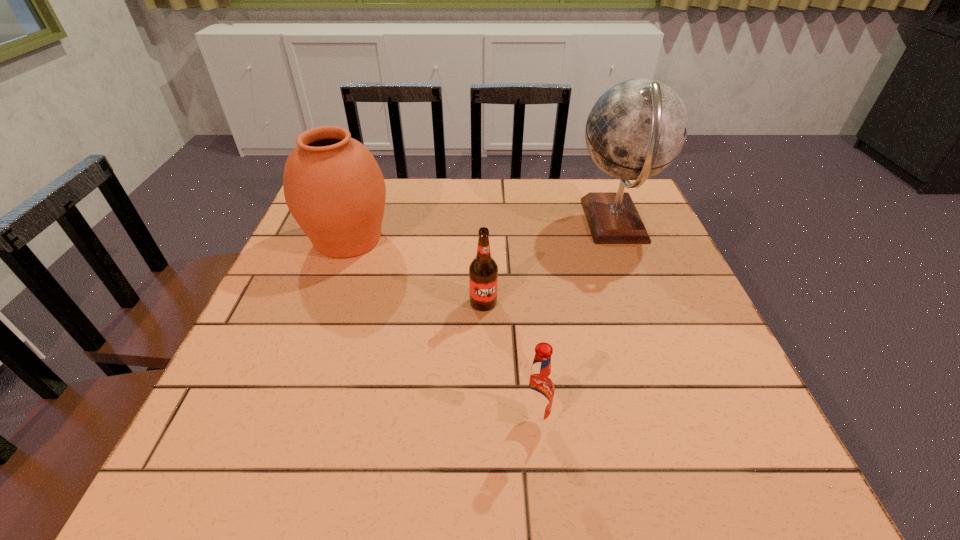
At what (x,y) coordinates should I click in order to perform the action: click on the tallest object. Please return your answer as a coordinate pair (x, y). The width and height of the screenshot is (960, 540). Looking at the image, I should click on click(x=637, y=128).

Where is `the rightmost object`? This screenshot has height=540, width=960. the rightmost object is located at coordinates (637, 128).

At what (x,y) coordinates should I click in order to perform the action: click on the second tallest object. Please return your answer as a coordinate pair (x, y). This screenshot has height=540, width=960. Looking at the image, I should click on (333, 186).

Identify the location of the leftmost object. (333, 186).

Find the location of a particular element. the farther root beer is located at coordinates (483, 271).

You are a GUI agent. You are given a task and a screenshot of the screen. Output one action in this format:
    pyautogui.click(x=<x>, y=<y>)
    Task: Click on the third object from right to left
    The height and width of the screenshot is (540, 960).
    Given the screenshot: What is the action you would take?
    pyautogui.click(x=483, y=271)

The image size is (960, 540). I want to click on the nearer root beer, so click(x=538, y=387).

The width and height of the screenshot is (960, 540). Identify the location of the nearest object. (538, 387).

Locate an element on the screen. vacant space situated at the equator of the rightmost object is located at coordinates (456, 222).

In order to click on free space located 0.260m at the equator of the rightmost object in this screenshot , I will do `click(474, 222)`.